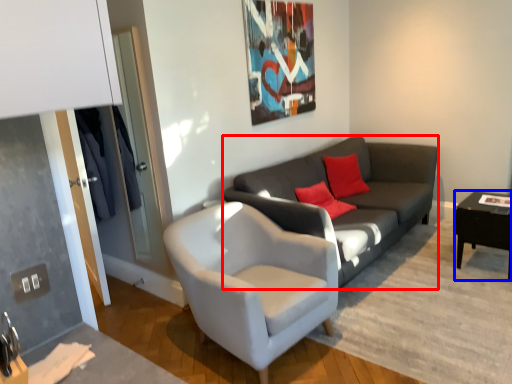
Question: Which object is further to the camera taking this photo, studio couch (highlighted by a red box) or table (highlighted by a blue box)?

Choices:
 (A) studio couch
 (B) table

Answer: (B)